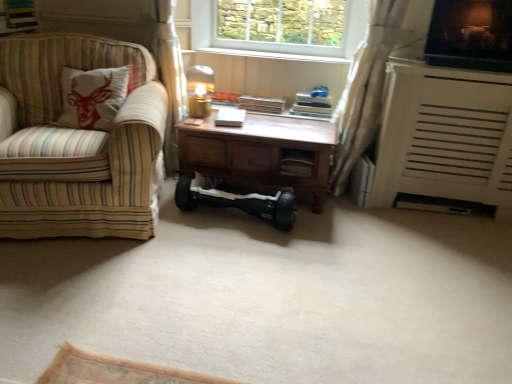
Question: From the image's perspective, is white sheer curtain at right under metallic gold table lamp at center?

Choices:
 (A) no
 (B) yes

Answer: (B)

Question: Is white sheer curtain at right facing away from metallic gold table lamp at center?

Choices:
 (A) no
 (B) yes

Answer: (A)

Question: Can you confirm if white sheer curtain at right is wider than metallic gold table lamp at center?

Choices:
 (A) yes
 (B) no

Answer: (A)

Question: Is white sheer curtain at right to the left of metallic gold table lamp at center from the viewer's perspective?

Choices:
 (A) no
 (B) yes

Answer: (A)

Question: Is the depth of white sheer curtain at right less than that of metallic gold table lamp at center?

Choices:
 (A) yes
 (B) no

Answer: (A)

Question: Can you confirm if white sheer curtain at right is thinner than metallic gold table lamp at center?

Choices:
 (A) no
 (B) yes

Answer: (A)

Question: Does wooden drawer at center turn towards white sheer curtain at right?

Choices:
 (A) yes
 (B) no

Answer: (B)

Question: Can you confirm if wooden drawer at center is wider than white sheer curtain at right?

Choices:
 (A) yes
 (B) no

Answer: (B)

Question: Is wooden drawer at center further to camera compared to white sheer curtain at right?

Choices:
 (A) yes
 (B) no

Answer: (A)

Question: Does wooden drawer at center have a greater height compared to white sheer curtain at right?

Choices:
 (A) no
 (B) yes

Answer: (A)

Question: Are wooden drawer at center and white sheer curtain at right located far from each other?

Choices:
 (A) yes
 (B) no

Answer: (B)

Question: Does wooden drawer at center have a lesser height compared to white sheer curtain at right?

Choices:
 (A) no
 (B) yes

Answer: (B)

Question: Is wooden desk at center to the left of black rubber hoverboard at center from the viewer's perspective?

Choices:
 (A) yes
 (B) no

Answer: (A)